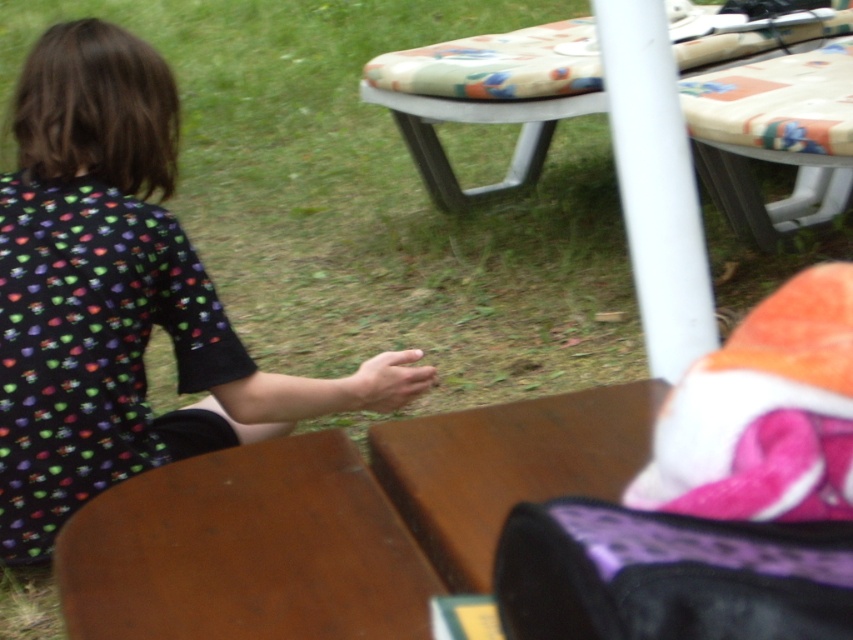
Based on the photo, you are standing at the center of the image and want to place a new item exactly at the center of the brown wooden table at lower left. What are the coordinates where you should place it?

The coordinates for the center of the brown wooden table at lower left are at point (247, 550).

You are standing at the picnic area and want to place a 20 inch long object between the printed fabric shirt at left and the brown wooden table at lower left. Is there enough space?

The printed fabric shirt at left is 32.31 inches away from the brown wooden table at lower left, so yes, there is enough space to place a 20 inch long object between them.

You are setting up a picnic and need to place a tall vase on the table. Which table, the brown wooden table at lower left or the brown wooden table at center, should you choose to ensure the vase doesn t tip over?

The brown wooden table at center has a greater height than the brown wooden table at lower left, so placing the tall vase on the brown wooden table at center would be more stable and less likely to tip over.